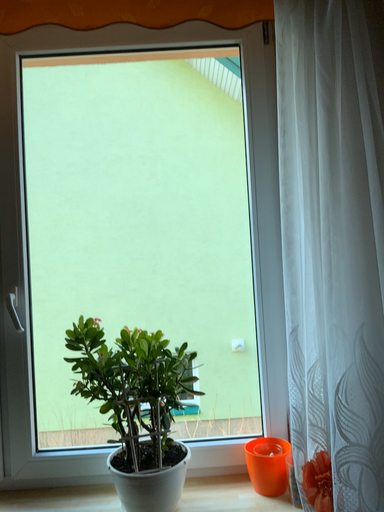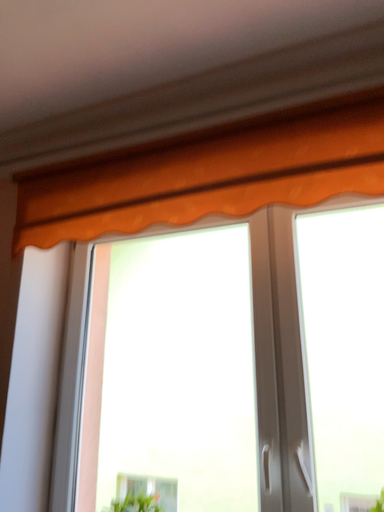
Question: How did the camera likely rotate when shooting the video?

Choices:
 (A) rotated downward
 (B) rotated upward

Answer: (B)